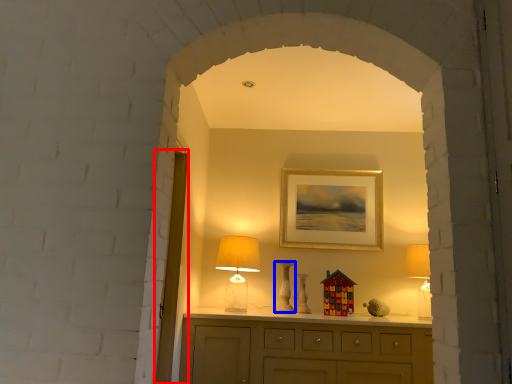
Question: Which point is further to the camera, glass door (highlighted by a red box) or vase (highlighted by a blue box)?

Choices:
 (A) glass door
 (B) vase

Answer: (B)